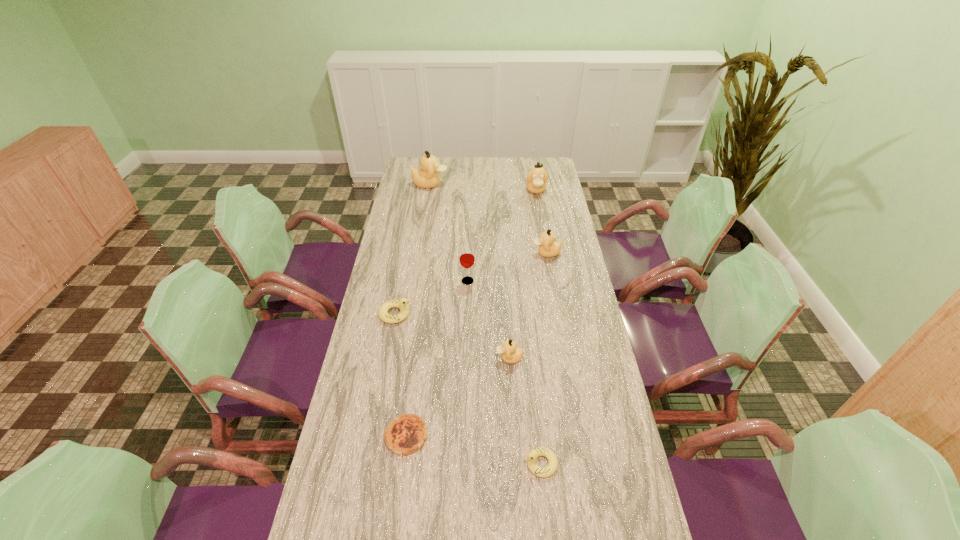
The height and width of the screenshot is (540, 960). I want to click on vacant space that is in between the quiche and the fifth nearest object, so click(x=437, y=359).

Identify the location of vacant area that lies between the quiche and the fourth shortest duckling. The width and height of the screenshot is (960, 540). (476, 345).

Where is `empty location between the fourth farthest object and the sixth nearest object`? Image resolution: width=960 pixels, height=540 pixels. empty location between the fourth farthest object and the sixth nearest object is located at coordinates [x=507, y=267].

Find the location of a particular element. The height and width of the screenshot is (540, 960). free space between the fifth shortest duckling and the second nearest tan duckling is located at coordinates (541, 221).

In order to click on free space that is in between the farther yellow duckling and the tallest duckling in this screenshot , I will do `click(413, 249)`.

What are the coordinates of `the sixth closest object to the third farthest object` in the screenshot? It's located at (406, 434).

Image resolution: width=960 pixels, height=540 pixels. Identify the location of object that is the fifth closest to the left yellow duckling. click(x=532, y=457).

Find the location of `the third closest duckling to the bigger yellow duckling`. the third closest duckling to the bigger yellow duckling is located at coordinates (532, 457).

Where is `duckling object that ranks as the closest to the second nearest tan duckling`? The height and width of the screenshot is (540, 960). duckling object that ranks as the closest to the second nearest tan duckling is located at coordinates (536, 179).

Locate which tan duckling ranks second in proximity to the shortest object. Please provide its 2D coordinates. Your answer should be formatted as a tuple, i.e. [(x, y)], where the tuple contains the x and y coordinates of a point satisfying the conditions above.

[(548, 247)]